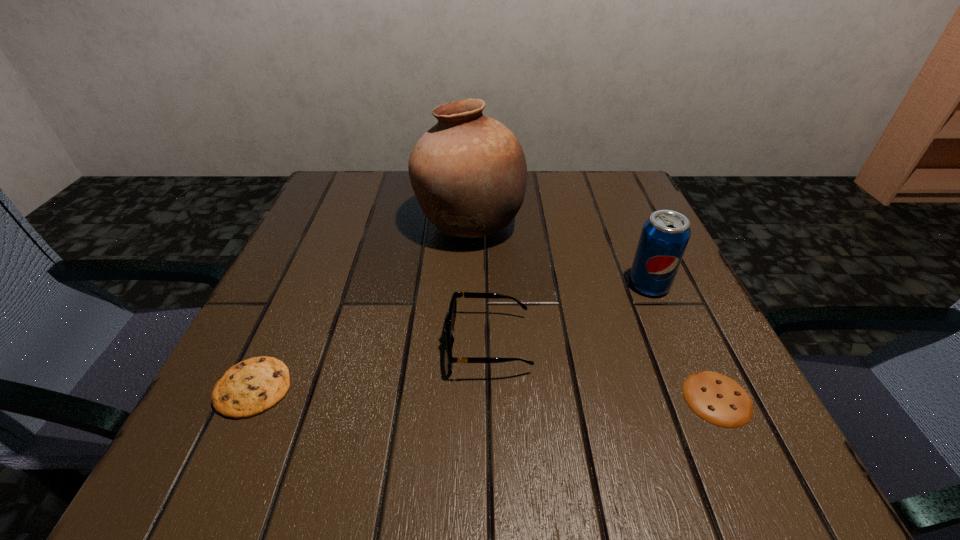
Locate an element on the screen. This screenshot has height=540, width=960. cookie that is at the right edge is located at coordinates (718, 399).

Where is `object that is positioned at the near right corner`? This screenshot has height=540, width=960. object that is positioned at the near right corner is located at coordinates (718, 399).

In the image, there is a desktop. At what (x,y) coordinates should I click in order to perform the action: click on vacant space at the far edge. Please return your answer as a coordinate pair (x, y). Looking at the image, I should click on (527, 185).

Locate an element on the screen. vacant space at the near edge of the desktop is located at coordinates (505, 463).

In the image, there is a desktop. Identify the location of vacant space at the left edge. This screenshot has height=540, width=960. (374, 229).

This screenshot has width=960, height=540. I want to click on vacant space at the right edge of the desktop, so click(x=631, y=353).

Image resolution: width=960 pixels, height=540 pixels. I want to click on vacant space at the far left corner of the desktop, so click(x=354, y=224).

In the image, there is a desktop. Identify the location of vacant region at the near left corner. [207, 482].

At what (x,y) coordinates should I click in order to perform the action: click on empty space that is in between the right cookie and the tallest object. Please return your answer as a coordinate pair (x, y). The image size is (960, 540). Looking at the image, I should click on (593, 310).

The width and height of the screenshot is (960, 540). Identify the location of vacant space that's between the sunglasses and the shortest object. (603, 371).